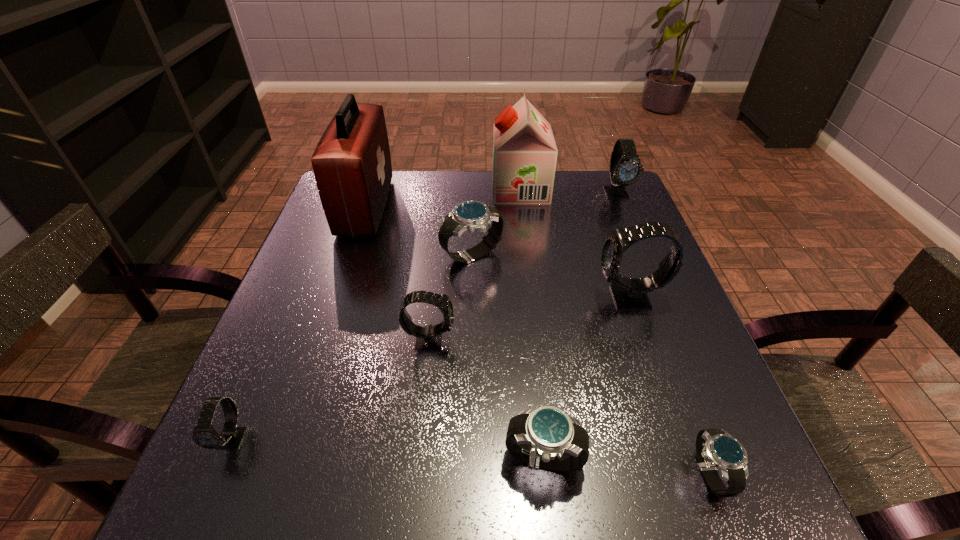
Locate an element on the screen. The height and width of the screenshot is (540, 960). free space between the leftmost watch and the sixth shortest object is located at coordinates (424, 316).

Identify the location of vacant point located between the smallest gray watch and the second biggest silver watch. (388, 450).

I want to click on vacant area between the second biggest silver watch and the first aid kit, so click(455, 334).

At what (x,y) coordinates should I click in order to perform the action: click on free space that is in between the second object from left to right and the farthest silver watch. Please return your answer as a coordinate pair (x, y). This screenshot has height=540, width=960. Looking at the image, I should click on (419, 231).

Identify the location of object that can be found as the fifth closest to the farthest silver watch. (625, 169).

Find the location of a particular element. This screenshot has height=540, width=960. object that stands as the closest to the farthest silver watch is located at coordinates (352, 166).

Find the location of a particular element. watch that can be found as the closest to the second biggest gray watch is located at coordinates (629, 293).

Point out which watch is positioned as the third nearest to the soya milk. Please provide its 2D coordinates. Your answer should be formatted as a tuple, i.e. [(x, y)], where the tuple contains the x and y coordinates of a point satisfying the conditions above.

[(629, 293)]

Identify the location of the third closest gray watch to the shortest object. (625, 169).

At what (x,y) coordinates should I click in order to perform the action: click on gray watch identified as the closest to the first aid kit. Please return your answer as a coordinate pair (x, y). Looking at the image, I should click on (428, 337).